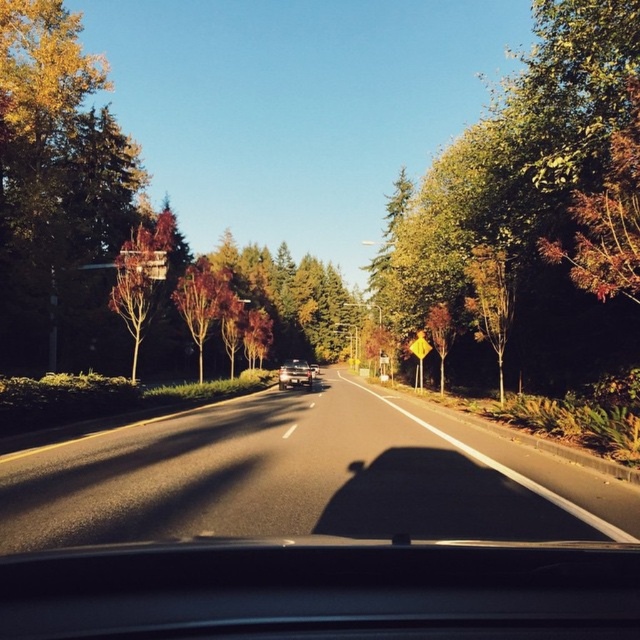
This screenshot has height=640, width=640. I want to click on transparent glass windshield at center, so click(x=323, y=589).

Measure the distance between transparent glass windshield at center and camera.

They are 39.20 meters apart.

Measure the distance between transparent glass windshield at center and camera.

transparent glass windshield at center is 39.20 meters away from camera.

I want to click on transparent glass windshield at center, so click(x=323, y=589).

Who is positioned more to the right, asphalt road at center or reddish-brown bark tree at center-left?

asphalt road at center is more to the right.

Between point (342, 442) and point (180, 308), which one is positioned behind?

The point (180, 308) is behind.

Between point (106, 490) and point (220, 310), which one is positioned behind?

The point (220, 310) is more distant.

Locate an element on the screen. This screenshot has height=640, width=640. asphalt road at center is located at coordinates (301, 477).

What do you see at coordinates (204, 301) in the screenshot? The image size is (640, 640). I see `reddish-brown bark tree at center-left` at bounding box center [204, 301].

Is point (211, 307) closer to viewer compared to point (438, 339)?

That is False.

Between point (195, 276) and point (444, 369), which one is positioned behind?

The point (444, 369) is more distant.

Find the location of a particular element. This screenshot has height=640, width=640. reddish-brown bark tree at center-left is located at coordinates (204, 301).